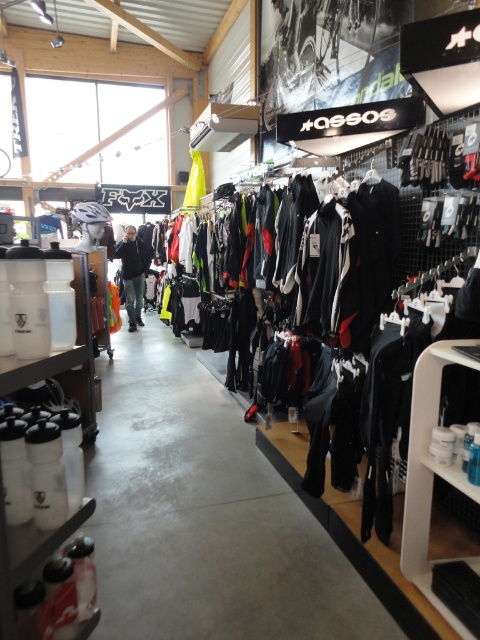
You are a customer in the store and want to place a small bag on the floor next to the white plastic bottles at lower right and the dark gray jacket at center. Which object should you place it closer to if you want the bag to be near the thinner item?

You should place the bag closer to the white plastic bottles at lower right because it is thinner than the dark gray jacket at center.

You are a customer in the store and want to pick up both the white plastic bottles at lower right and the dark gray jacket at center. Which item will require you to bend down more to reach it?

The white plastic bottles at lower right is smaller than dark gray jacket at center, so you will need to bend down more to reach the white plastic bottles at lower right.